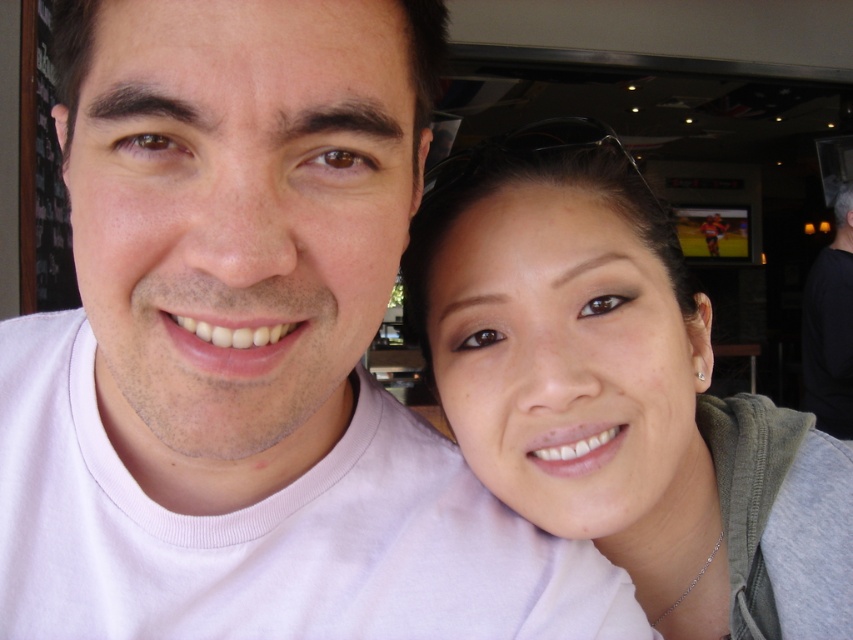
Question: Among these points, which one is farthest from the camera?

Choices:
 (A) (511, 285)
 (B) (846, 371)

Answer: (B)

Question: Does matte gray hoodie at right have a greater width compared to black matte hair at upper right?

Choices:
 (A) no
 (B) yes

Answer: (B)

Question: Which of the following is the farthest from the observer?

Choices:
 (A) (708, 422)
 (B) (843, 310)

Answer: (B)

Question: Considering the relative positions of matte gray hoodie at right and black matte hair at upper right in the image provided, where is matte gray hoodie at right located with respect to black matte hair at upper right?

Choices:
 (A) left
 (B) right

Answer: (A)

Question: Which point appears farthest from the camera in this image?

Choices:
 (A) (839, 209)
 (B) (831, 460)

Answer: (A)

Question: Does matte gray hoodie at right lie behind black matte hair at upper right?

Choices:
 (A) no
 (B) yes

Answer: (A)